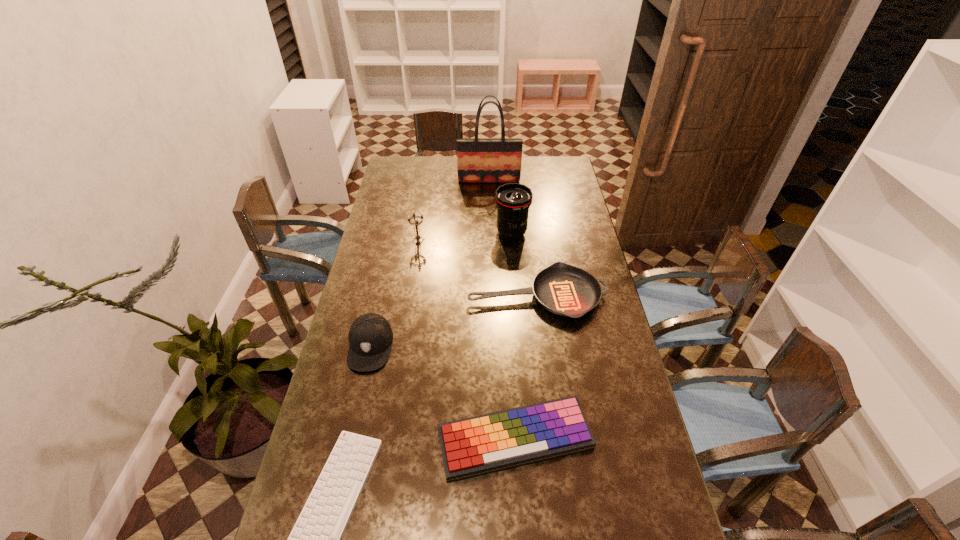
The width and height of the screenshot is (960, 540). Find the location of `free space at the far right corner of the desktop`. free space at the far right corner of the desktop is located at coordinates [567, 168].

Identify the location of free space between the frying pan and the telephoto lens. Image resolution: width=960 pixels, height=540 pixels. (524, 265).

You are a GUI agent. You are given a task and a screenshot of the screen. Output one action in this format:
    pyautogui.click(x=<x>, y=<y>)
    Task: Click on the vacant region between the fifth shortest object and the frying pan
    This screenshot has width=960, height=540.
    Given the screenshot: What is the action you would take?
    pyautogui.click(x=478, y=268)

Image resolution: width=960 pixels, height=540 pixels. Find the location of `vacant region between the candle holder and the frying pan`. vacant region between the candle holder and the frying pan is located at coordinates (478, 268).

You are a GUI agent. You are given a task and a screenshot of the screen. Output one action in this format:
    pyautogui.click(x=<x>, y=<y>)
    Task: Click on the unoccupied position between the telephoto lens and the frying pan
    The width and height of the screenshot is (960, 540).
    Given the screenshot: What is the action you would take?
    pyautogui.click(x=524, y=265)

Find the location of a particular element. free space that is in between the candle holder and the taller computer keyboard is located at coordinates (467, 340).

Identify the location of vacant point located between the taller computer keyboard and the fifth shortest object. (467, 340).

In order to click on object that is the fourth nearest to the frying pan in this screenshot , I will do `click(482, 444)`.

Identify which object is located as the third nearest to the tallest object. Please provide its 2D coordinates. Your answer should be formatted as a tuple, i.e. [(x, y)], where the tuple contains the x and y coordinates of a point satisfying the conditions above.

[(563, 289)]

Identify the location of free space that satisfies the following two spatial constraints: 1. on the front-facing side of the shopping bag; 2. on the left side of the right computer keyboard. (496, 440).